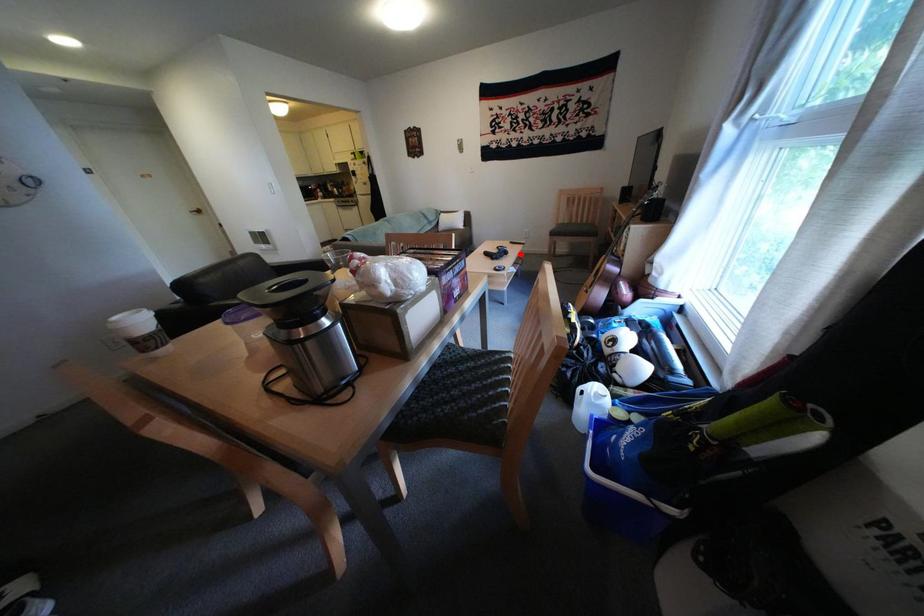
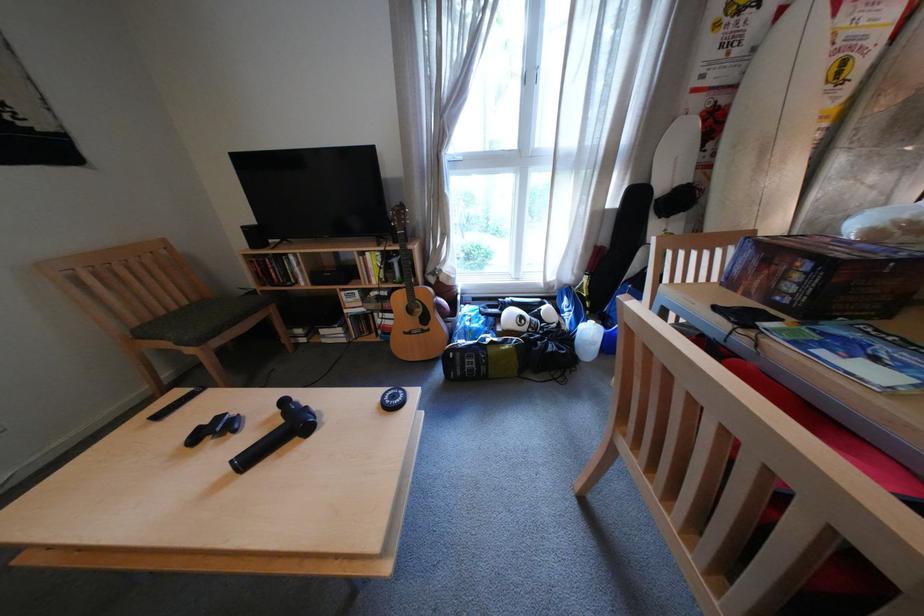
Question: I am providing you with two images of the same scene from different viewpoints. A red point is marked on the first image. Is the red point's position out of view in image 2?

Choices:
 (A) Yes
 (B) No

Answer: (B)